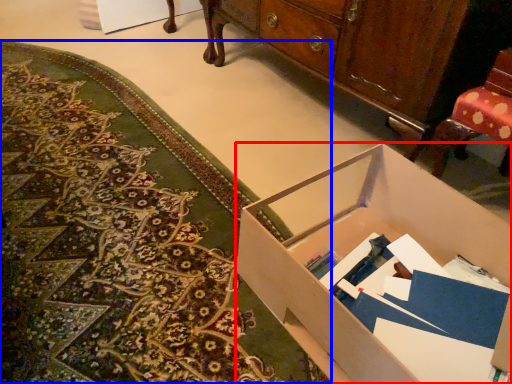
Question: Which of the following is the farthest to the observer, desk (highlighted by a red box) or mat (highlighted by a blue box)?

Choices:
 (A) desk
 (B) mat

Answer: (B)